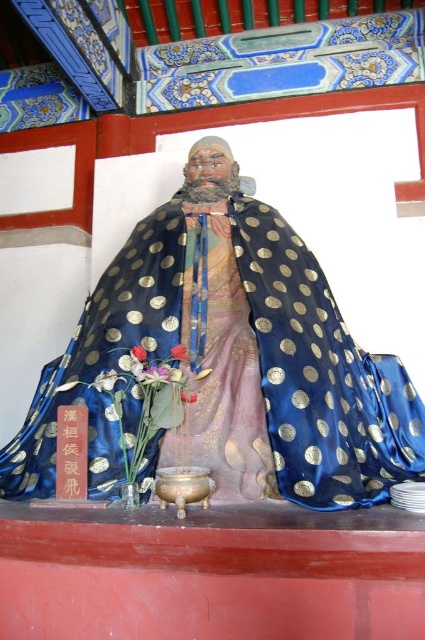
Question: Can you confirm if blue satin cape at center is positioned below vivid pink petals at center?

Choices:
 (A) no
 (B) yes

Answer: (A)

Question: Is vivid pink petals at center closer to camera compared to pink silk flower at center?

Choices:
 (A) yes
 (B) no

Answer: (B)

Question: Considering the real-world distances, which object is farthest from the pink silk flower at center?

Choices:
 (A) blue satin cape at center
 (B) vivid pink petals at center

Answer: (A)

Question: Which point is closer to the camera taking this photo?

Choices:
 (A) (172, 348)
 (B) (339, 497)

Answer: (B)

Question: Is blue satin cape at center thinner than vivid pink petals at center?

Choices:
 (A) yes
 (B) no

Answer: (B)

Question: Which of the following is the farthest from the observer?

Choices:
 (A) vivid pink petals at center
 (B) blue satin cape at center

Answer: (A)